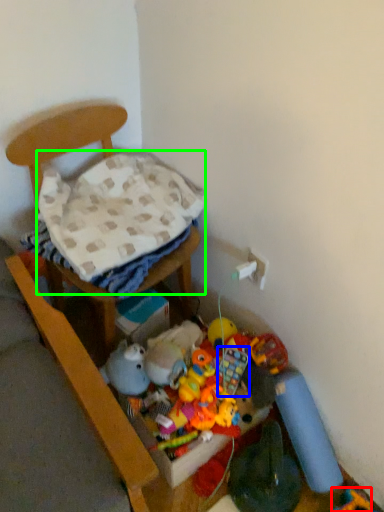
Question: Which object is positioned closest to toy (highlighted by a red box)? Select from toy (highlighted by a blue box) and blanket (highlighted by a green box).

Choices:
 (A) toy
 (B) blanket

Answer: (A)